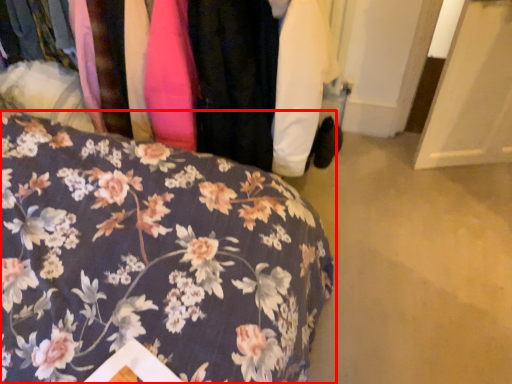
Question: Where is furniture (annotated by the red box) located in relation to closet in the image?

Choices:
 (A) left
 (B) right

Answer: (A)